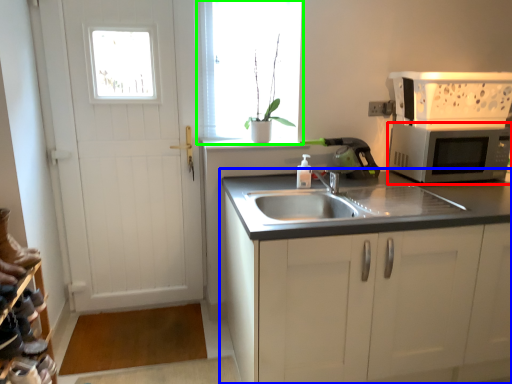
Question: Estimate the real-world distances between objects in this image. Which object is farther from microwave oven (highlighted by a red box), cabinetry (highlighted by a blue box) or window (highlighted by a green box)?

Choices:
 (A) cabinetry
 (B) window

Answer: (B)